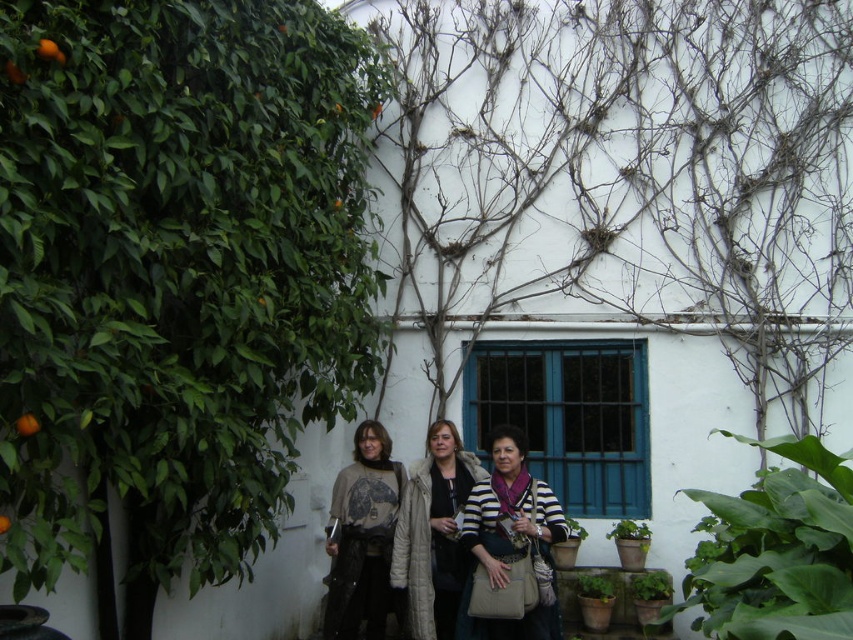
Question: Does green leafy tree at left appear under white fur coat at center?

Choices:
 (A) no
 (B) yes

Answer: (A)

Question: Which object appears closest to the camera in this image?

Choices:
 (A) dry vines at center
 (B) striped fabric scarf at center
 (C) orangesmoothfruit at upper left
 (D) green leafy tree at left

Answer: (D)

Question: Which point is closer to the camera taking this photo?

Choices:
 (A) (202, 45)
 (B) (426, 586)
 (C) (663, 310)
 (D) (370, 422)

Answer: (A)

Question: Is green leafy tree at left bigger than striped fabric scarf at center?

Choices:
 (A) no
 (B) yes

Answer: (B)

Question: Which object appears closest to the camera in this image?

Choices:
 (A) orange matte at left
 (B) striped fabric scarf at center
 (C) orangesmoothfruit at upper left

Answer: (A)

Question: Is green leafy tree at left to the right of dry vines at center from the viewer's perspective?

Choices:
 (A) no
 (B) yes

Answer: (A)